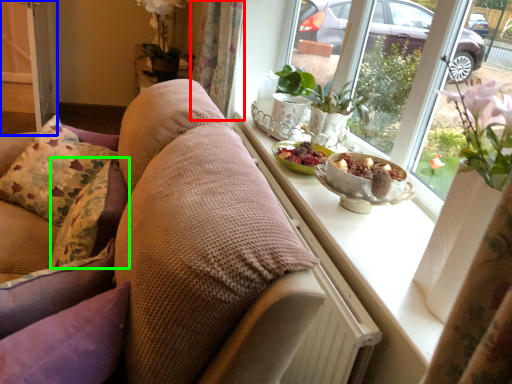
Question: Which object is the farthest from curtain (highlighted by a red box)? Choose among these: screen door (highlighted by a blue box) or pillow (highlighted by a green box).

Choices:
 (A) screen door
 (B) pillow

Answer: (A)